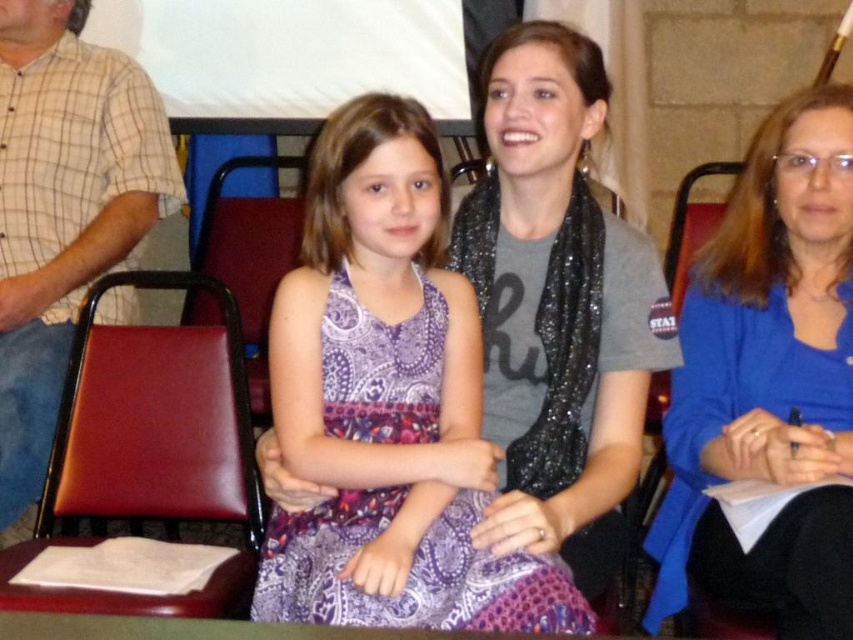
Consider the image. In the scene described, there is a blue fabric shirt at right and a red leather chair at right. Which object takes up more space in the image?

The red leather chair at right occupies more space than the blue fabric shirt at right, as the blue fabric shirt at right is mentioned to occupy less space.

You are standing in front of this group photo and want to place a sticker on the point that is closer to you. Which point should you choose between point (837, 138) and point (654, 404)?

Point (837, 138) is closer to the viewer than point (654, 404), so you should choose point (837, 138).